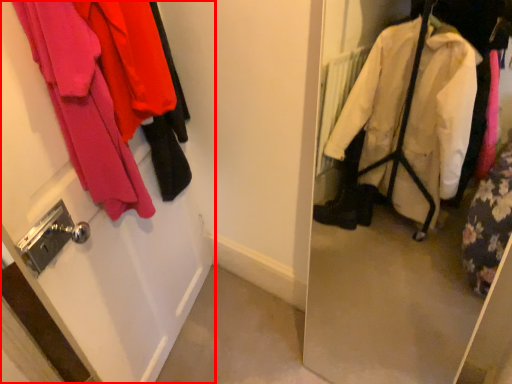
Question: From the image's perspective, what is the correct spatial positioning of door (annotated by the red box) in reference to closet?

Choices:
 (A) above
 (B) below

Answer: (B)